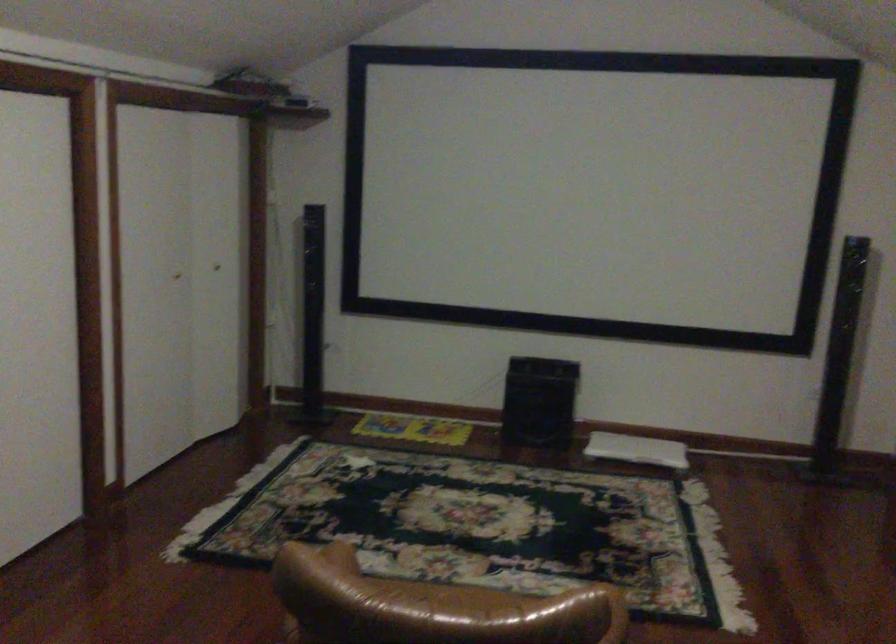
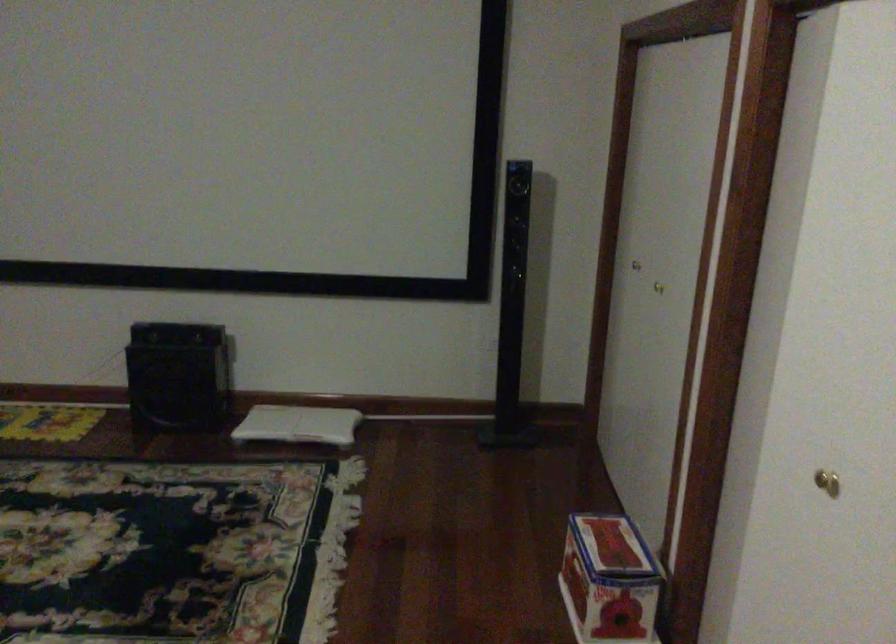
Question: The first image is from the beginning of the video and the second image is from the end. How did the camera likely rotate when shooting the video?

Choices:
 (A) Left
 (B) Right
 (C) Up
 (D) Down

Answer: (B)